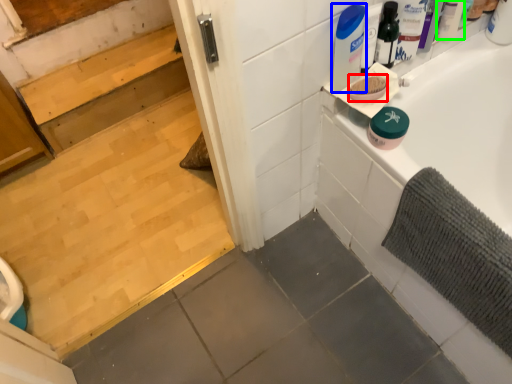
Question: Which object is the farthest from soap (highlighted by a red box)? Choose among these: cleaning product (highlighted by a blue box) or toiletry (highlighted by a green box).

Choices:
 (A) cleaning product
 (B) toiletry

Answer: (B)